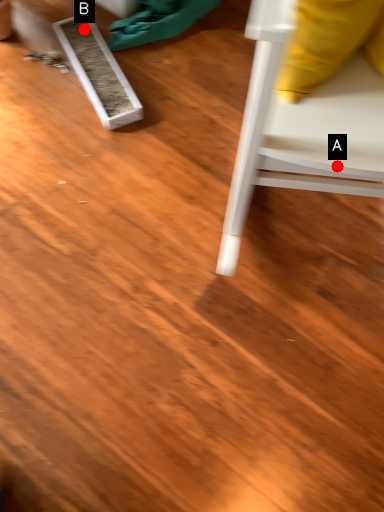
Question: Two points are circled on the image, labeled by A and B beside each circle. Among these points, which one is nearest to the camera?

Choices:
 (A) A is closer
 (B) B is closer

Answer: (A)